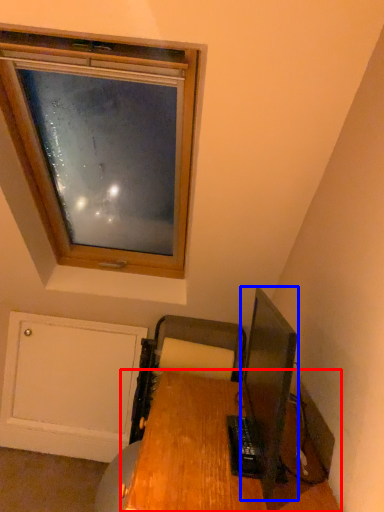
Question: Which of the following is the closest to the observer, desk (highlighted by a red box) or television (highlighted by a blue box)?

Choices:
 (A) desk
 (B) television

Answer: (A)